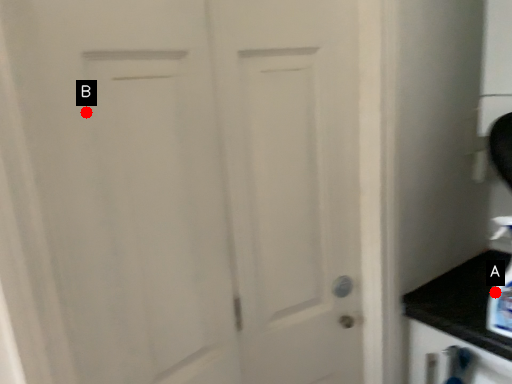
Question: Two points are circled on the image, labeled by A and B beside each circle. Which of the following is the closest to the observer?

Choices:
 (A) A is closer
 (B) B is closer

Answer: (B)